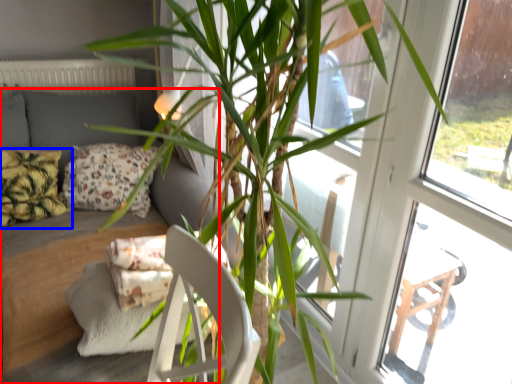
Question: Among these objects, which one is nearest to the camera, studio couch (highlighted by a red box) or pillow (highlighted by a blue box)?

Choices:
 (A) studio couch
 (B) pillow

Answer: (A)